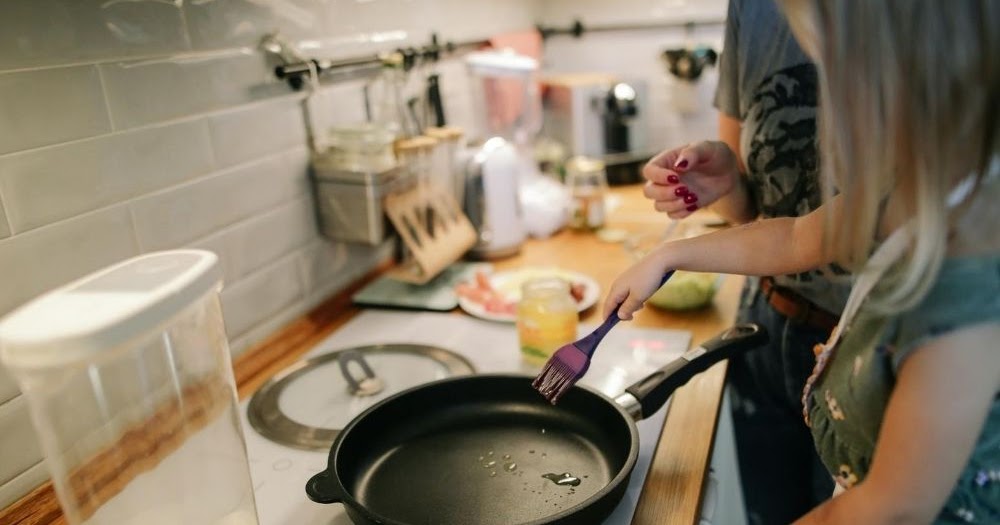
Identify the location of blender. The height and width of the screenshot is (525, 1000). (511, 108).